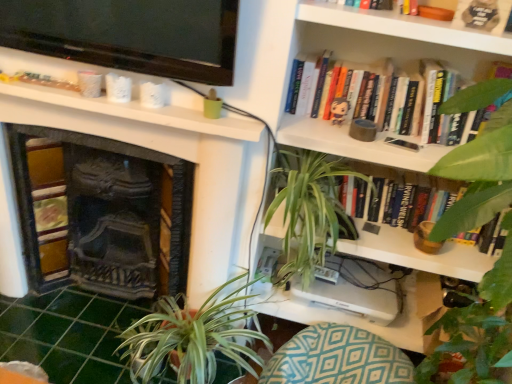
Question: Is hardcover book at upper right, the third book from the bottom, not within teal diamond-patterned cushion at lower center?

Choices:
 (A) yes
 (B) no

Answer: (A)

Question: Does hardcover book at upper right, which is the first book in top-to-bottom order, have a greater width compared to teal diamond-patterned cushion at lower center?

Choices:
 (A) no
 (B) yes

Answer: (A)

Question: From a real-world perspective, is hardcover book at upper right, the third book from the bottom, physically above teal diamond-patterned cushion at lower center?

Choices:
 (A) no
 (B) yes

Answer: (B)

Question: Is hardcover book at upper right, the third book from the bottom, taller than teal diamond-patterned cushion at lower center?

Choices:
 (A) yes
 (B) no

Answer: (B)

Question: From the image's perspective, is hardcover book at upper right, which is the first book in top-to-bottom order, on top of teal diamond-patterned cushion at lower center?

Choices:
 (A) yes
 (B) no

Answer: (A)

Question: In terms of width, does hardcover book at upper right, which is the first book in top-to-bottom order, look wider or thinner when compared to hardcover book at center, which ranks as the third book in top-to-bottom order?

Choices:
 (A) thin
 (B) wide

Answer: (B)

Question: Visually, is hardcover book at upper right, the third book from the bottom, positioned to the left or to the right of hardcover book at center, placed as the 1th book when sorted from bottom to top?

Choices:
 (A) right
 (B) left

Answer: (B)

Question: From the image's perspective, relative to hardcover book at center, placed as the 1th book when sorted from bottom to top, is hardcover book at upper right, which is the first book in top-to-bottom order, above or below?

Choices:
 (A) below
 (B) above

Answer: (B)

Question: Is hardcover book at upper right, which is the first book in top-to-bottom order, bigger or smaller than hardcover book at center, placed as the 1th book when sorted from bottom to top?

Choices:
 (A) small
 (B) big

Answer: (A)

Question: Visually, is matte plastic toy at upper center positioned to the left or to the right of green leafy plant at upper right, which appears as the second vegetation when viewed from the left?

Choices:
 (A) left
 (B) right

Answer: (A)

Question: From a real-world perspective, is matte plastic toy at upper center positioned above or below green leafy plant at upper right, which appears as the second vegetation when viewed from the left?

Choices:
 (A) above
 (B) below

Answer: (A)

Question: Is point (338, 117) closer or farther from the camera than point (485, 367)?

Choices:
 (A) farther
 (B) closer

Answer: (A)

Question: Looking at the image, does matte plastic toy at upper center seem bigger or smaller compared to green leafy plant at upper right, which appears as the second vegetation when viewed from the left?

Choices:
 (A) big
 (B) small

Answer: (B)

Question: From a real-world perspective, relative to teal diamond-patterned cushion at lower center, is hardcover book at upper right, which is the first book in top-to-bottom order, vertically above or below?

Choices:
 (A) above
 (B) below

Answer: (A)

Question: Looking at the image, does hardcover book at upper right, the third book from the bottom, seem bigger or smaller compared to teal diamond-patterned cushion at lower center?

Choices:
 (A) small
 (B) big

Answer: (A)